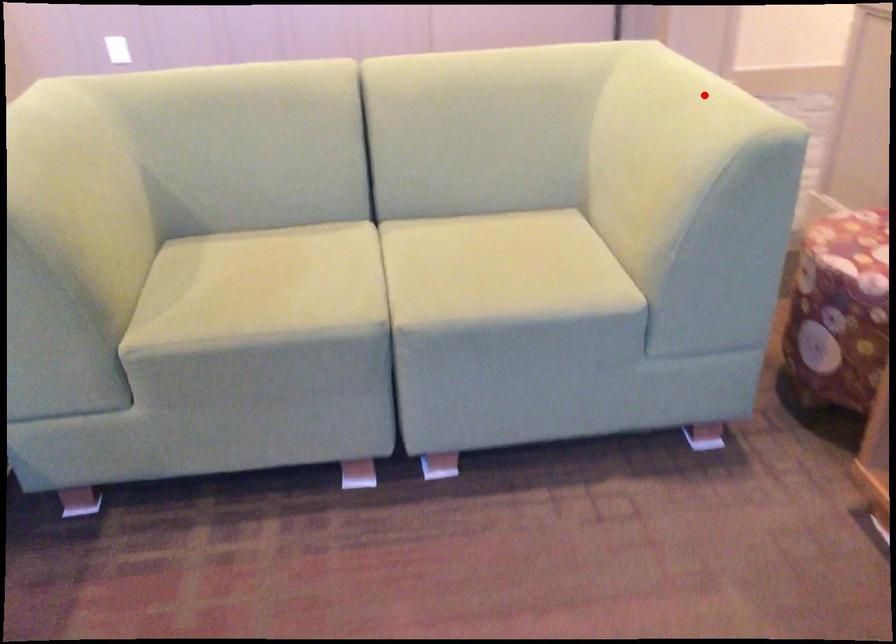
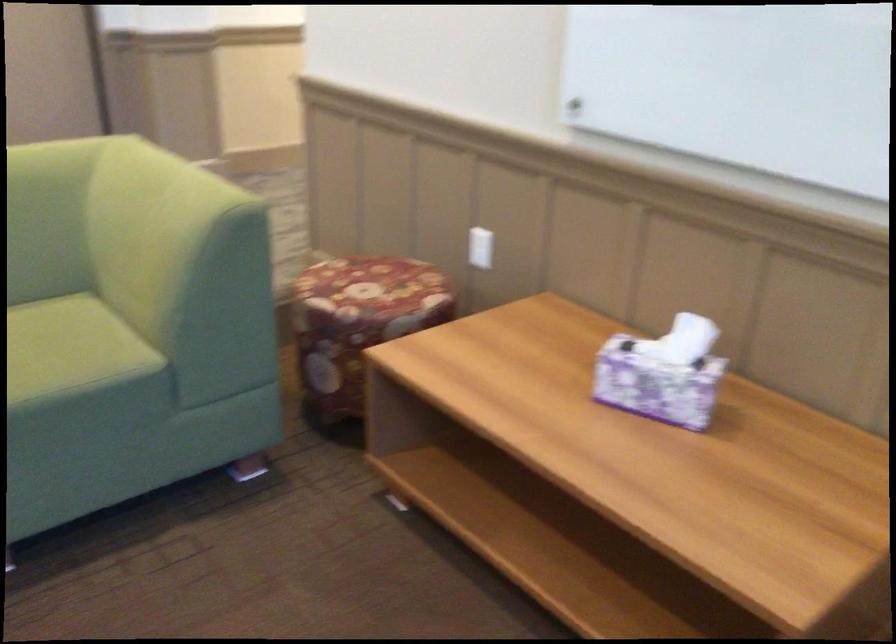
Question: I am providing you with two images of the same scene from different viewpoints. A red point is shown in image1. For the corresponding object point in image2, is it positioned nearer or farther from the camera?

Choices:
 (A) Nearer
 (B) Farther

Answer: (B)